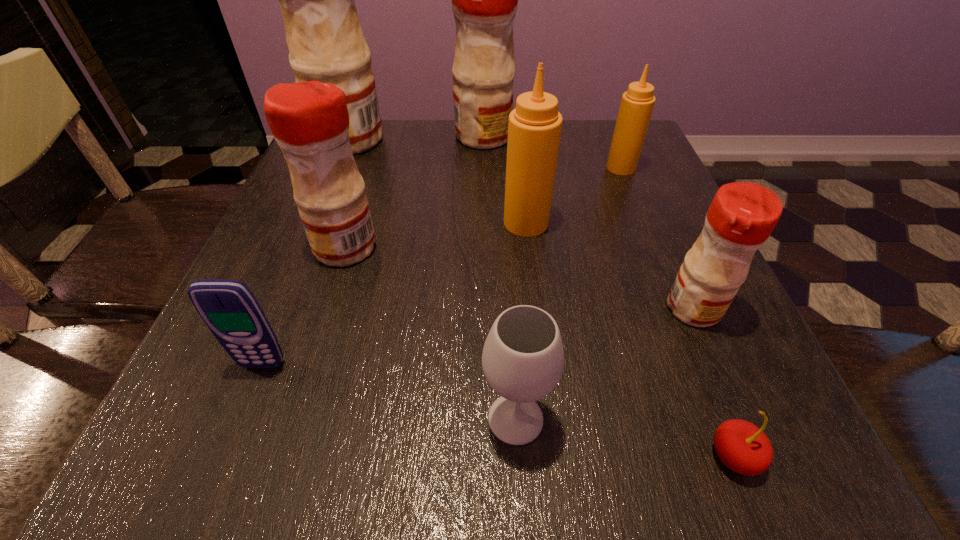
Locate an element on the screen. Image resolution: width=960 pixels, height=540 pixels. the tallest condiment is located at coordinates (324, 36).

Find the location of `the tallest object`. the tallest object is located at coordinates (324, 36).

This screenshot has height=540, width=960. In order to click on the fifth shortest condiment in this screenshot , I will do `click(484, 0)`.

Locate an element on the screen. The width and height of the screenshot is (960, 540). the eighth shortest object is located at coordinates (484, 0).

Identify the location of the bigger tan condiment. This screenshot has width=960, height=540. (534, 129).

Find the location of `the nearer tan condiment`. the nearer tan condiment is located at coordinates (534, 129).

I want to click on the second smallest red condiment, so click(x=309, y=120).

The height and width of the screenshot is (540, 960). Identify the location of the right tan condiment. (637, 103).

I want to click on the third farthest object, so click(x=637, y=103).

Where is `the fourth nearest object`? the fourth nearest object is located at coordinates (742, 215).